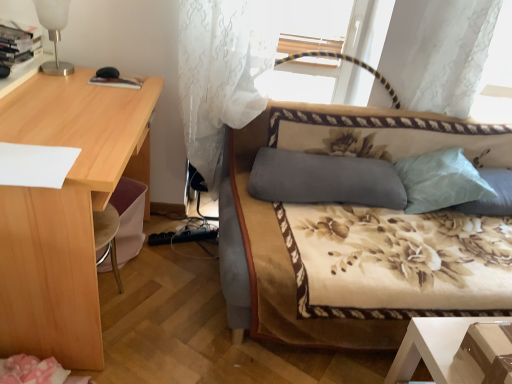
I want to click on free space above light wood desk at left (from a real-world perspective), so click(78, 109).